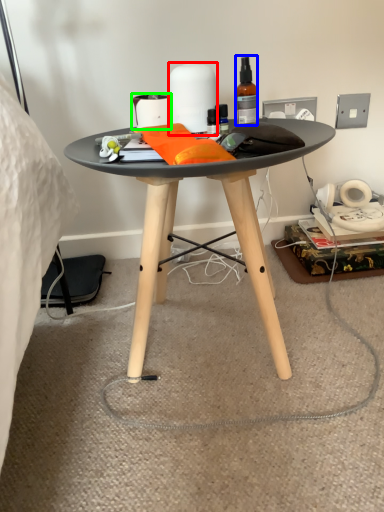
Question: Considering the real-world distances, which object is closest to toilet paper (highlighted by a red box)? bottle (highlighted by a blue box) or toilet paper (highlighted by a green box).

Choices:
 (A) bottle
 (B) toilet paper

Answer: (B)